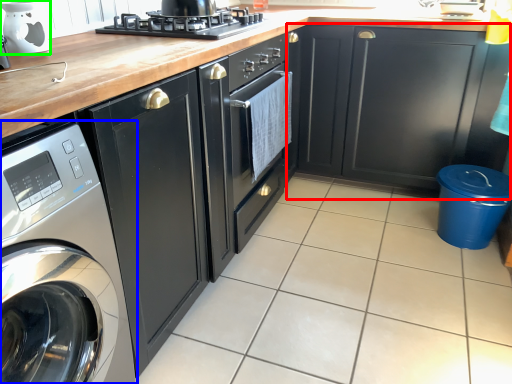
Question: Based on their relative distances, which object is nearer to cabinetry (highlighted by a red box)? Choose from home appliance (highlighted by a blue box) and appliance (highlighted by a green box).

Choices:
 (A) home appliance
 (B) appliance

Answer: (B)